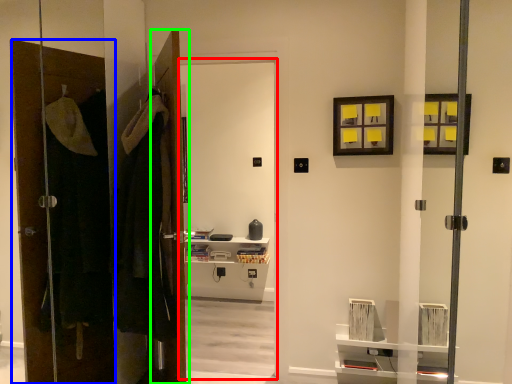
Question: Which object is positioned closest to screen door (highlighted by a red box)? Select from door (highlighted by a blue box) and door (highlighted by a green box).

Choices:
 (A) door
 (B) door

Answer: (B)